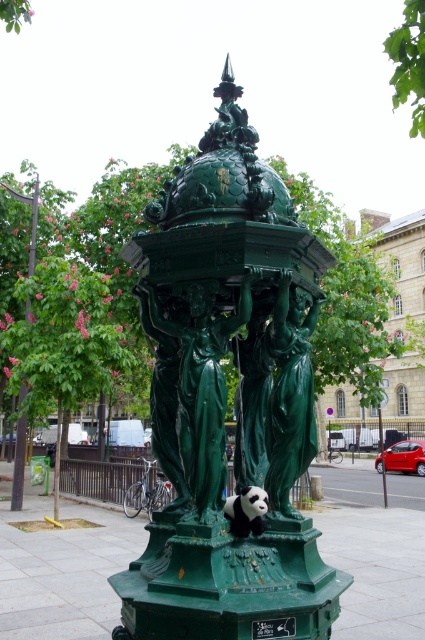
Question: Observing the image, what is the correct spatial positioning of green polished water fountain at center in reference to white plush panda at center?

Choices:
 (A) left
 (B) right

Answer: (A)

Question: Does green polished water fountain at center have a smaller size compared to white plush panda at center?

Choices:
 (A) no
 (B) yes

Answer: (A)

Question: Among these points, which one is farthest from the camera?

Choices:
 (A) (255, 499)
 (B) (181, 349)

Answer: (B)

Question: Which point appears farthest from the camera in this image?

Choices:
 (A) (260, 529)
 (B) (187, 368)

Answer: (A)

Question: Which point is farther to the camera?

Choices:
 (A) (212, 218)
 (B) (231, 518)

Answer: (A)

Question: Is green polished water fountain at center below white plush panda at center?

Choices:
 (A) no
 (B) yes

Answer: (A)